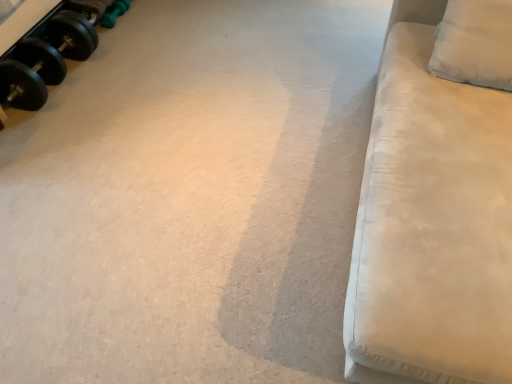
What do you see at coordinates (114, 13) in the screenshot?
I see `green rubber dumbbell at upper left, which appears as the first dumbbell when viewed from the back` at bounding box center [114, 13].

Image resolution: width=512 pixels, height=384 pixels. What are the coordinates of `green rubber dumbbell at upper left, marked as the 2th dumbbell in a front-to-back arrangement` in the screenshot? It's located at (114, 13).

From a real-world perspective, is white fabric couch at right over green rubber dumbbell at upper left, marked as the 2th dumbbell in a front-to-back arrangement?

Yes, from a real-world perspective, white fabric couch at right is on top of green rubber dumbbell at upper left, marked as the 2th dumbbell in a front-to-back arrangement.

Does white fabric couch at right have a greater height compared to green rubber dumbbell at upper left, which appears as the first dumbbell when viewed from the back?

Indeed, white fabric couch at right has a greater height compared to green rubber dumbbell at upper left, which appears as the first dumbbell when viewed from the back.

Is the depth of white fabric couch at right greater than that of green rubber dumbbell at upper left, marked as the 2th dumbbell in a front-to-back arrangement?

No, white fabric couch at right is closer to the viewer.

Which of these two, white fabric couch at right or green rubber dumbbell at upper left, marked as the 2th dumbbell in a front-to-back arrangement, is smaller?

green rubber dumbbell at upper left, marked as the 2th dumbbell in a front-to-back arrangement.

Is white fabric pillow at upper right far away from white fabric couch at right?

No, white fabric pillow at upper right is not far away from white fabric couch at right.

Considering the sizes of objects white fabric pillow at upper right and white fabric couch at right in the image provided, who is smaller, white fabric pillow at upper right or white fabric couch at right?

Smaller between the two is white fabric pillow at upper right.

Does white fabric pillow at upper right have a greater height compared to white fabric couch at right?

In fact, white fabric pillow at upper right may be shorter than white fabric couch at right.

How different are the orientations of white fabric pillow at upper right and white fabric couch at right in degrees?

78.1 degrees separate the facing orientations of white fabric pillow at upper right and white fabric couch at right.

Which is in front, white fabric couch at right or black rubber dumbbell at upper left, marked as the 2th dumbbell in a back-to-front arrangement?

Positioned in front is white fabric couch at right.

Are white fabric couch at right and black rubber dumbbell at upper left, the 1th dumbbell in the front-to-back sequence, far apart?

white fabric couch at right is positioned a significant distance from black rubber dumbbell at upper left, the 1th dumbbell in the front-to-back sequence.

At what (x,y) coordinates should I click in order to perform the action: click on furniture lying below the black rubber dumbbell at upper left, marked as the 2th dumbbell in a back-to-front arrangement (from the image's perspective). Please return your answer as a coordinate pair (x, y). Image resolution: width=512 pixels, height=384 pixels. Looking at the image, I should click on (431, 222).

Does point (111, 6) lie in front of point (461, 86)?

No.

From the image's perspective, is green rubber dumbbell at upper left, marked as the 2th dumbbell in a front-to-back arrangement, above white fabric couch at right?

Correct, green rubber dumbbell at upper left, marked as the 2th dumbbell in a front-to-back arrangement, appears higher than white fabric couch at right in the image.

Can you confirm if green rubber dumbbell at upper left, which appears as the first dumbbell when viewed from the back, is wider than white fabric couch at right?

No, green rubber dumbbell at upper left, which appears as the first dumbbell when viewed from the back, is not wider than white fabric couch at right.

Is green rubber dumbbell at upper left, which appears as the first dumbbell when viewed from the back, far away from white fabric couch at right?

Yes.

Between green rubber dumbbell at upper left, which appears as the first dumbbell when viewed from the back, and black rubber dumbbell at upper left, the 1th dumbbell in the front-to-back sequence, which one has smaller size?

green rubber dumbbell at upper left, which appears as the first dumbbell when viewed from the back.

Are green rubber dumbbell at upper left, which appears as the first dumbbell when viewed from the back, and black rubber dumbbell at upper left, the 1th dumbbell in the front-to-back sequence, far apart?

No, green rubber dumbbell at upper left, which appears as the first dumbbell when viewed from the back, is not far away from black rubber dumbbell at upper left, the 1th dumbbell in the front-to-back sequence.

Considering the positions of points (112, 15) and (96, 11), is point (112, 15) closer to camera compared to point (96, 11)?

No, (112, 15) is further to viewer.

Identify the location of dumbbell behind the black rubber dumbbell at upper left, marked as the 2th dumbbell in a back-to-front arrangement. (x=114, y=13).

Considering the relative positions of black rubber dumbbell at upper left, the 1th dumbbell in the front-to-back sequence, and white fabric pillow at upper right in the image provided, is black rubber dumbbell at upper left, the 1th dumbbell in the front-to-back sequence, to the left of white fabric pillow at upper right from the viewer's perspective?

Yes.

How different are the orientations of black rubber dumbbell at upper left, marked as the 2th dumbbell in a back-to-front arrangement, and white fabric pillow at upper right in degrees?

101 degrees.

Based on the photo, can you see black rubber dumbbell at upper left, the 1th dumbbell in the front-to-back sequence, touching white fabric pillow at upper right?

black rubber dumbbell at upper left, the 1th dumbbell in the front-to-back sequence, and white fabric pillow at upper right are not in contact.

From a real-world perspective, who is located higher, black rubber dumbbell at upper left, marked as the 2th dumbbell in a back-to-front arrangement, or white fabric pillow at upper right?

From a 3D spatial view, white fabric pillow at upper right is above.

Considering the relative sizes of white fabric pillow at upper right and black rubber dumbbell at upper left, marked as the 2th dumbbell in a back-to-front arrangement, in the image provided, is white fabric pillow at upper right taller than black rubber dumbbell at upper left, marked as the 2th dumbbell in a back-to-front arrangement,?

Indeed, white fabric pillow at upper right has a greater height compared to black rubber dumbbell at upper left, marked as the 2th dumbbell in a back-to-front arrangement.

Is point (490, 61) closer to viewer compared to point (75, 4)?

That is True.

Based on the photo, from the image's perspective, which one is positioned higher, white fabric pillow at upper right or black rubber dumbbell at upper left, the 1th dumbbell in the front-to-back sequence?

black rubber dumbbell at upper left, the 1th dumbbell in the front-to-back sequence.

In the image, there is a green rubber dumbbell at upper left, which appears as the first dumbbell when viewed from the back. Identify the location of furniture below it (from the image's perspective). The image size is (512, 384). (431, 222).

Find the location of a particular element. furniture below the white fabric pillow at upper right (from a real-world perspective) is located at coordinates (431, 222).

From the image, which object appears to be farther from white fabric pillow at upper right, white fabric couch at right or black rubber dumbbell at upper left, the 1th dumbbell in the front-to-back sequence?

black rubber dumbbell at upper left, the 1th dumbbell in the front-to-back sequence, is positioned further to the anchor white fabric pillow at upper right.

From the image, which object appears to be nearer to green rubber dumbbell at upper left, which appears as the first dumbbell when viewed from the back, white fabric pillow at upper right or white fabric couch at right?

white fabric pillow at upper right is closer to green rubber dumbbell at upper left, which appears as the first dumbbell when viewed from the back.

Looking at the image, which one is located closer to black rubber dumbbell at upper left, the 1th dumbbell in the front-to-back sequence, white fabric couch at right or green rubber dumbbell at upper left, marked as the 2th dumbbell in a front-to-back arrangement?

Based on the image, green rubber dumbbell at upper left, marked as the 2th dumbbell in a front-to-back arrangement, appears to be nearer to black rubber dumbbell at upper left, the 1th dumbbell in the front-to-back sequence.

Considering their positions, is black rubber dumbbell at upper left, the 1th dumbbell in the front-to-back sequence, positioned further to green rubber dumbbell at upper left, marked as the 2th dumbbell in a front-to-back arrangement, than white fabric couch at right?

white fabric couch at right is positioned further to the anchor green rubber dumbbell at upper left, marked as the 2th dumbbell in a front-to-back arrangement.

Based on their spatial positions, is white fabric pillow at upper right or black rubber dumbbell at upper left, the 1th dumbbell in the front-to-back sequence, closer to white fabric couch at right?

Among the two, white fabric pillow at upper right is located nearer to white fabric couch at right.

Which object lies further to the anchor point black rubber dumbbell at upper left, marked as the 2th dumbbell in a back-to-front arrangement, white fabric couch at right or white fabric pillow at upper right?

white fabric couch at right.

Looking at the image, which one is located closer to white fabric couch at right, green rubber dumbbell at upper left, which appears as the first dumbbell when viewed from the back, or white fabric pillow at upper right?

white fabric pillow at upper right is closer to white fabric couch at right.

When comparing their distances from white fabric couch at right, does black rubber dumbbell at upper left, the 1th dumbbell in the front-to-back sequence, or green rubber dumbbell at upper left, which appears as the first dumbbell when viewed from the back, seem further?

green rubber dumbbell at upper left, which appears as the first dumbbell when viewed from the back, lies further to white fabric couch at right than the other object.

Where is `pillow positioned between white fabric couch at right and green rubber dumbbell at upper left, which appears as the first dumbbell when viewed from the back, from near to far`? This screenshot has height=384, width=512. pillow positioned between white fabric couch at right and green rubber dumbbell at upper left, which appears as the first dumbbell when viewed from the back, from near to far is located at coordinates (475, 43).

Locate an element on the screen. The height and width of the screenshot is (384, 512). dumbbell between white fabric couch at right and green rubber dumbbell at upper left, marked as the 2th dumbbell in a front-to-back arrangement, along the z-axis is located at coordinates (89, 8).

In order to click on furniture located between black rubber dumbbell at upper left, the 1th dumbbell in the front-to-back sequence, and white fabric pillow at upper right in the left-right direction in this screenshot , I will do `click(431, 222)`.

Where is `dumbbell between black rubber dumbbell at upper left, marked as the 2th dumbbell in a back-to-front arrangement, and white fabric pillow at upper right`? This screenshot has width=512, height=384. dumbbell between black rubber dumbbell at upper left, marked as the 2th dumbbell in a back-to-front arrangement, and white fabric pillow at upper right is located at coordinates 114,13.